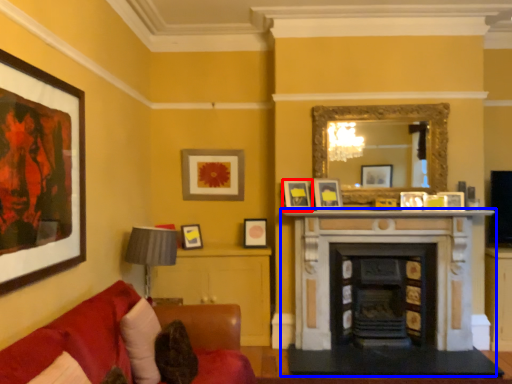
Question: Which object appears closest to the camera in this image, picture frame (highlighted by a red box) or fireplace (highlighted by a blue box)?

Choices:
 (A) picture frame
 (B) fireplace

Answer: (B)